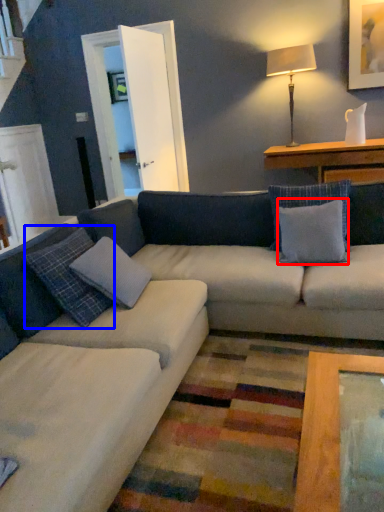
Question: Among these objects, which one is nearest to the camera, pillow (highlighted by a red box) or pillow (highlighted by a blue box)?

Choices:
 (A) pillow
 (B) pillow

Answer: (B)